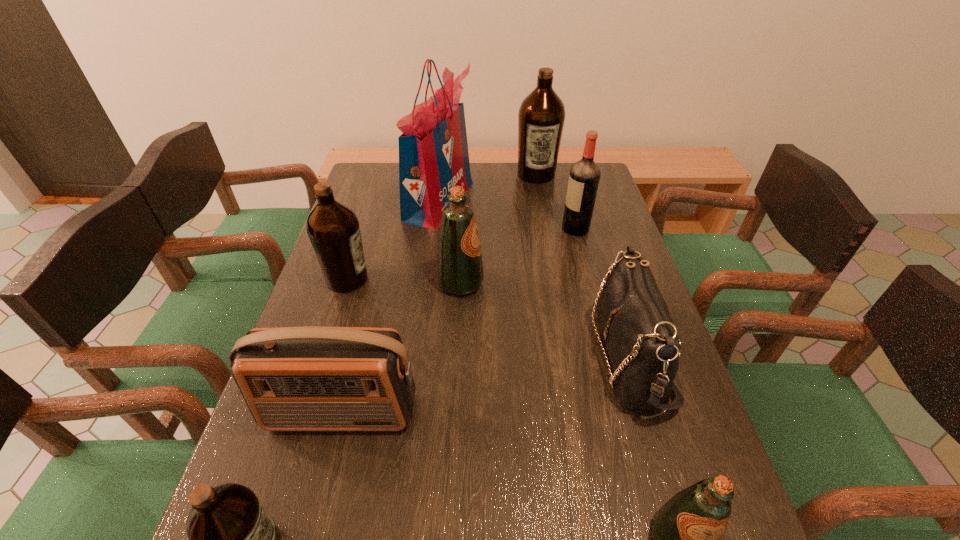
Locate an element on the screen. This screenshot has height=540, width=960. vacant space located on the front-facing side of the grocery bag is located at coordinates (584, 201).

Where is `vacant space located on the label of the farthest olive oil`? Image resolution: width=960 pixels, height=540 pixels. vacant space located on the label of the farthest olive oil is located at coordinates (542, 207).

The height and width of the screenshot is (540, 960). Find the location of `free location located 0.380m on the front-facing side of the liquor`. free location located 0.380m on the front-facing side of the liquor is located at coordinates (443, 228).

Find the location of a particular element. free space located 0.060m on the front-facing side of the liquor is located at coordinates click(x=543, y=228).

In order to click on vacant space positioned on the front-facing side of the liquor in this screenshot , I will do `click(480, 228)`.

The image size is (960, 540). Identify the location of vacant space located on the front-facing side of the third olive oil from right to left. (549, 283).

Find the location of `vacant space located on the label of the second farthest brown olive oil`. vacant space located on the label of the second farthest brown olive oil is located at coordinates (396, 279).

Image resolution: width=960 pixels, height=540 pixels. What are the coordinates of `vacant space located 0.160m on the front-facing side of the radio receiver` in the screenshot? It's located at (314, 521).

I want to click on vacant region located at the front of the handbag with chain and zipper, so click(x=570, y=355).

Where is `vacant space situated 0.120m at the front of the handbag with chain and zipper`? The image size is (960, 540). vacant space situated 0.120m at the front of the handbag with chain and zipper is located at coordinates (544, 355).